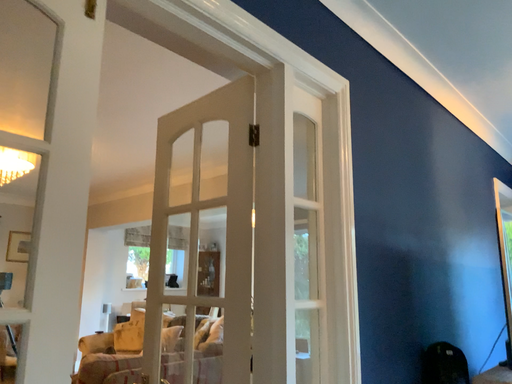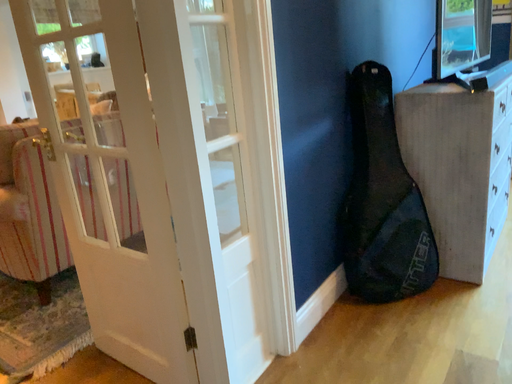
Question: How did the camera likely rotate when shooting the video?

Choices:
 (A) rotated left
 (B) rotated right

Answer: (B)